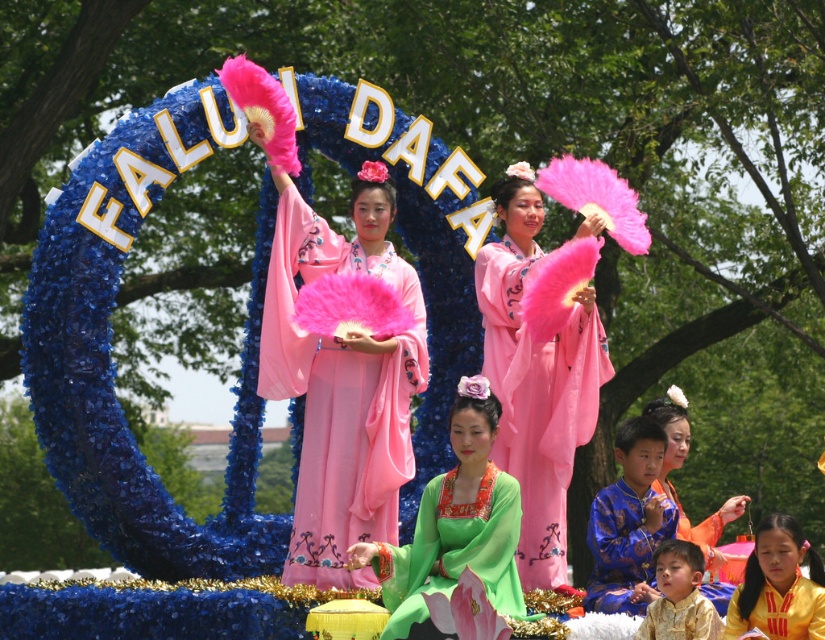
Can you confirm if matte pink silk kimono at center is taller than pink satin kimono at center?

In fact, matte pink silk kimono at center may be shorter than pink satin kimono at center.

Between point (380, 497) and point (512, 433), which one is positioned in front?

Point (380, 497) is more forward.

Locate an element on the screen. Image resolution: width=825 pixels, height=640 pixels. matte pink silk kimono at center is located at coordinates (342, 385).

Does green silk dress at center have a greater height compared to gold silk robe at lower right?

Correct, green silk dress at center is much taller as gold silk robe at lower right.

Does point (415, 548) lie in front of point (680, 602)?

No, (415, 548) is further to viewer.

At what (x,y) coordinates should I click in order to perform the action: click on green silk dress at center. Please return your answer as a coordinate pair (x, y). Looking at the image, I should click on (455, 525).

Who is more distant from viewer, (x=472, y=394) or (x=644, y=548)?

The point (x=644, y=548) is behind.

I want to click on green silk dress at center, so click(x=455, y=525).